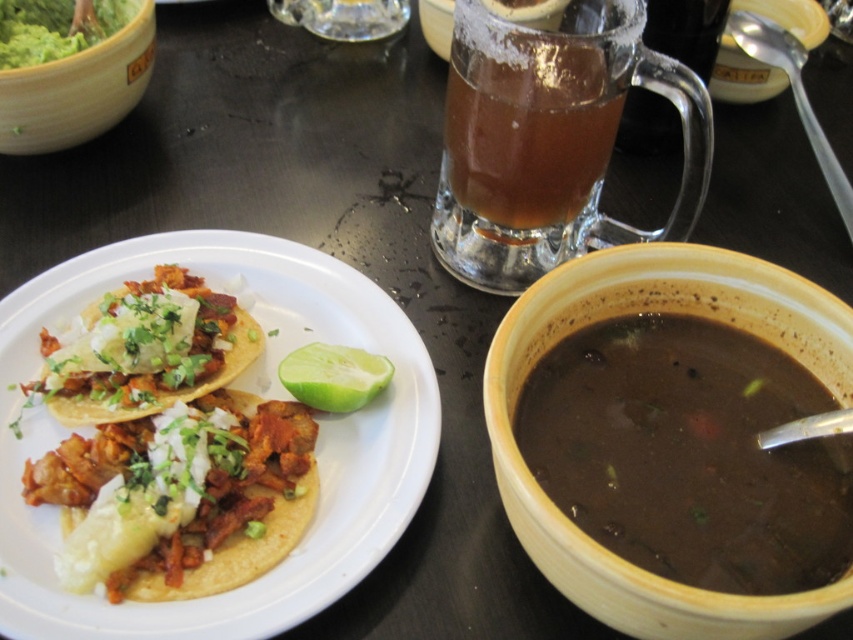
Question: Is translucent glass mug at upper center positioned in front of green matte lime at center?

Choices:
 (A) no
 (B) yes

Answer: (B)

Question: Is green smooth guacamole at upper left positioned behind green matte lime at center?

Choices:
 (A) no
 (B) yes

Answer: (B)

Question: Is the position of brown stoneware bowl at center right less distant than that of shiny silver tacos at left?

Choices:
 (A) no
 (B) yes

Answer: (B)

Question: Which point is farther from the camera taking this photo?

Choices:
 (A) (166, 380)
 (B) (811, 310)

Answer: (A)

Question: Which of the following is the closest to the observer?

Choices:
 (A) (86, 86)
 (B) (183, 572)
 (C) (109, 8)
 (D) (596, 113)

Answer: (B)

Question: Which is farther from the shiny silver taco at left?

Choices:
 (A) green smooth guacamole at upper left
 (B) translucent glass mug at upper center

Answer: (A)